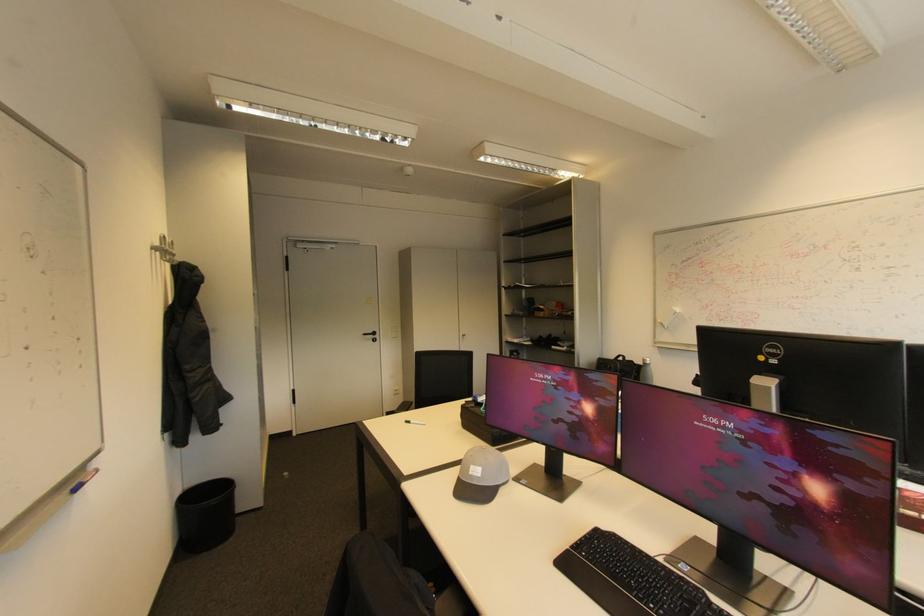
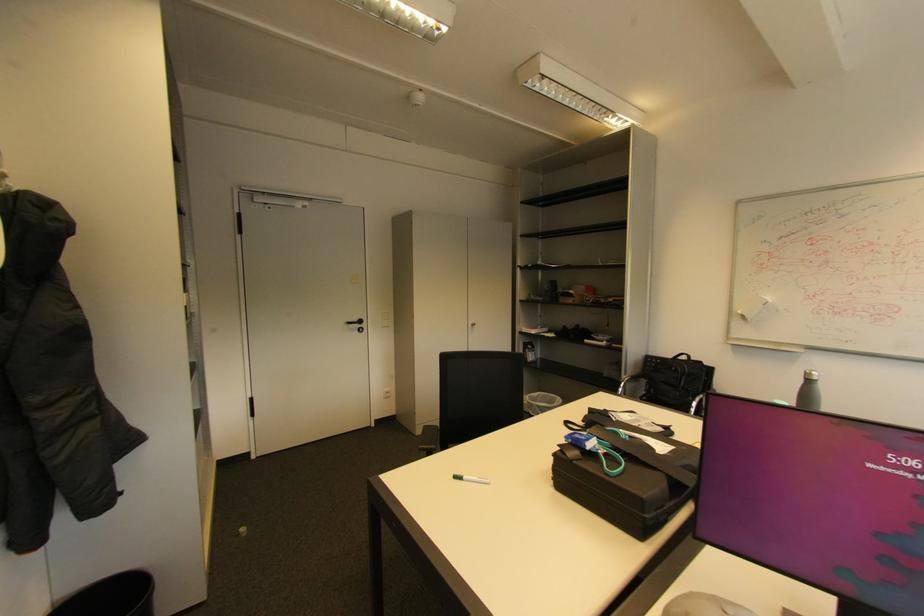
In the second image, find the point that corresponds to the point at 468,408 in the first image.

(561, 456)